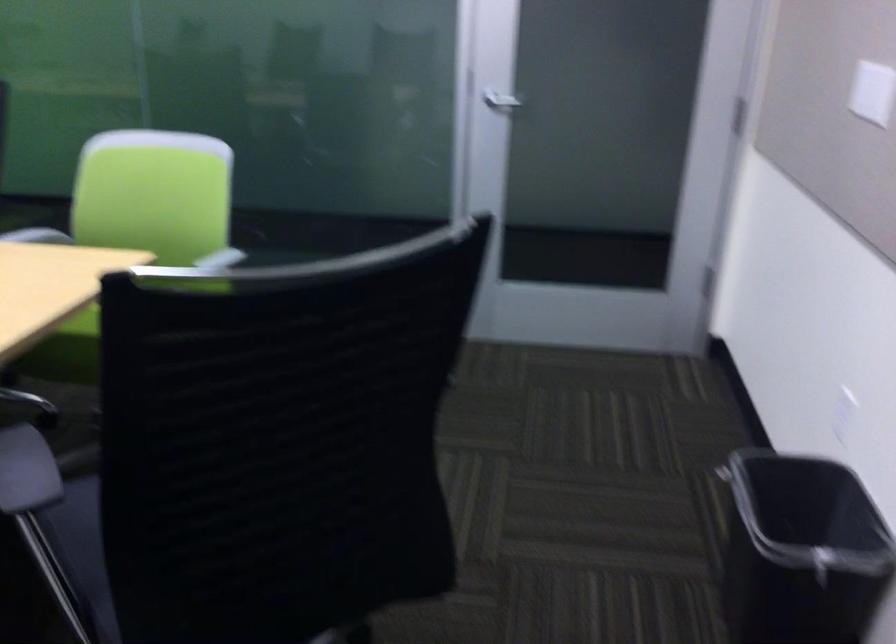
The width and height of the screenshot is (896, 644). I want to click on green chair sitting surface, so click(x=82, y=322).